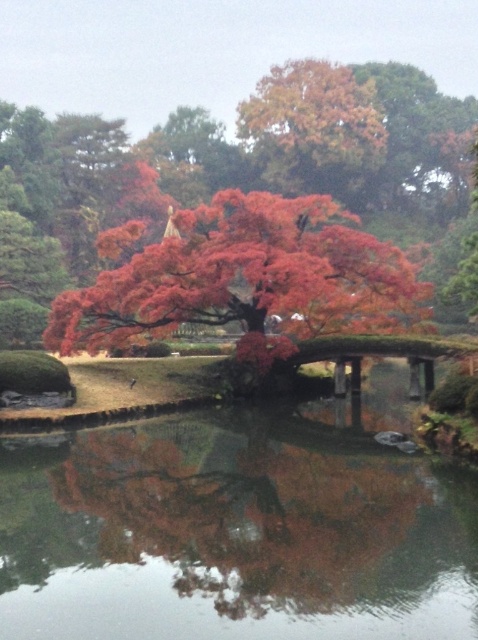
In the scene shown: How distant is orange-brown textured tree at upper center from green moss-covered bridge at center?

A distance of 82.63 meters exists between orange-brown textured tree at upper center and green moss-covered bridge at center.

Is orange-brown textured tree at upper center in front of green moss-covered bridge at center?

No, it is behind green moss-covered bridge at center.

Locate an element on the screen. This screenshot has height=640, width=478. orange-brown textured tree at upper center is located at coordinates (313, 129).

At what (x,y) coordinates should I click in order to perform the action: click on orange-brown textured tree at upper center. Please return your answer as a coordinate pair (x, y). The image size is (478, 640). Looking at the image, I should click on (313, 129).

From the picture: Does transparent water at center appear over green moss-covered bridge at center?

No, transparent water at center is not above green moss-covered bridge at center.

Does transparent water at center appear on the right side of green moss-covered bridge at center?

Incorrect, transparent water at center is not on the right side of green moss-covered bridge at center.

Find the location of a particular element. transparent water at center is located at coordinates (234, 532).

Between point (316, 259) and point (428, 385), which one is positioned in front?

Positioned in front is point (316, 259).

You are a GUI agent. You are given a task and a screenshot of the screen. Output one action in this format:
    pyautogui.click(x=<x>, y=<y>)
    Task: Click on the shiny red maple tree at center
    The image size is (478, 640).
    Given the screenshot: What is the action you would take?
    pyautogui.click(x=246, y=276)